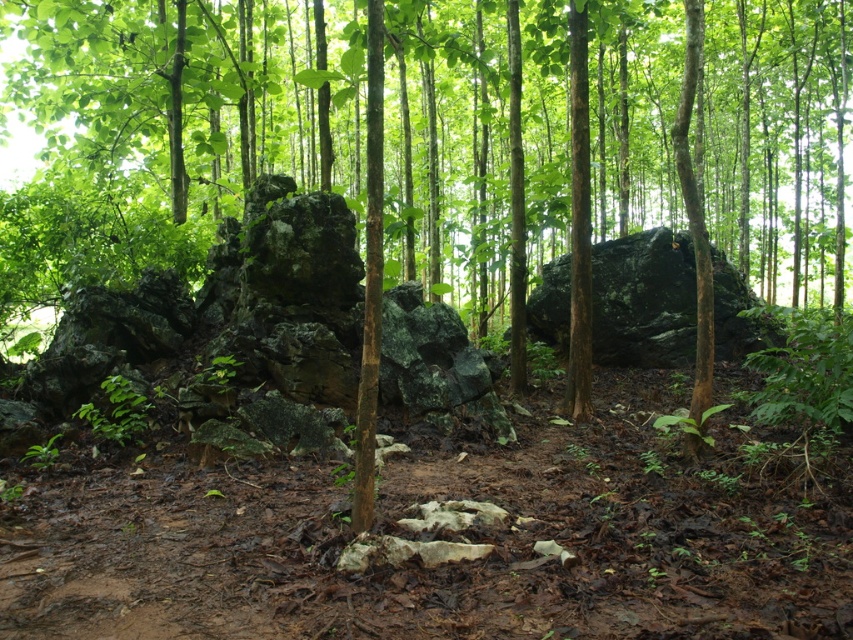
Who is positioned more to the right, green rough bark tree at center or dark gray rough rock at center?

green rough bark tree at center

Is point (563, 218) positioned in front of point (340, 228)?

No, (563, 218) is further to viewer.

Image resolution: width=853 pixels, height=640 pixels. Identify the location of green rough bark tree at center. (161, 128).

Identify the location of green rough bark tree at center. (161, 128).